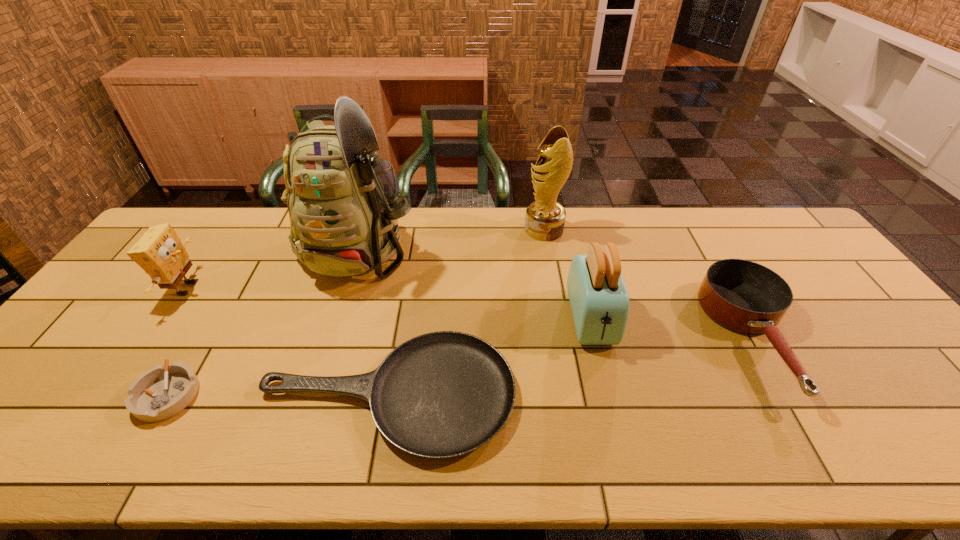
Image resolution: width=960 pixels, height=540 pixels. Identify the location of object that is at the near edge. (442, 394).

Identify the location of free region at the far edge of the desktop. The image size is (960, 540). (715, 207).

At what (x,y) coordinates should I click in order to perform the action: click on free spot at the near edge of the desktop. Please return your answer as a coordinate pair (x, y). This screenshot has height=540, width=960. Looking at the image, I should click on (576, 452).

This screenshot has height=540, width=960. Identify the location of free point at the right edge. (917, 421).

Locate an element on the screen. vacant area at the far left corner is located at coordinates (181, 215).

Where is `vacant area that lies between the fourth tallest object and the frying pan`? This screenshot has height=540, width=960. vacant area that lies between the fourth tallest object and the frying pan is located at coordinates (287, 342).

Where is `free space between the fifth shortest object and the backpack`? This screenshot has height=540, width=960. free space between the fifth shortest object and the backpack is located at coordinates (475, 282).

Where is `empty space that is in between the sixth object from right to left and the tallest object`? The height and width of the screenshot is (540, 960). empty space that is in between the sixth object from right to left and the tallest object is located at coordinates (264, 320).

Find the location of a particular element. The width and height of the screenshot is (960, 540). vacant space that is in between the frying pan and the second object from left to right is located at coordinates (278, 395).

Find the location of a particular element. free spot between the award and the pan is located at coordinates coord(649,284).